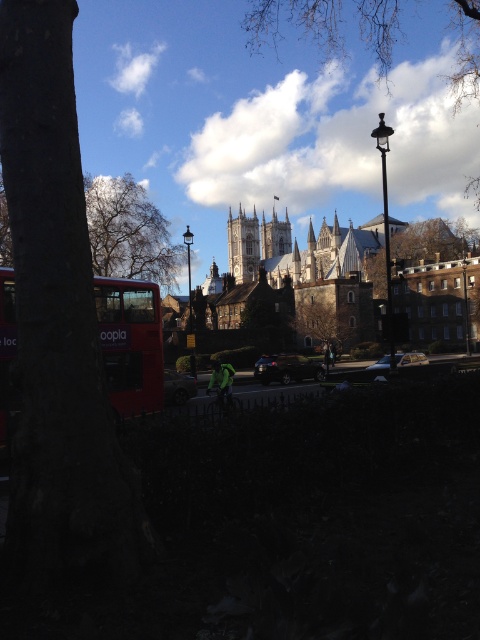
You are a pedestrian standing at the edge of the road and want to cross to the historic building. There are two objects blocking your view of the building. Which object is closer to you between the green leafy tree at center and the shiny black car at center?

The green leafy tree at center is closer to you because the shiny black car at center is behind it.